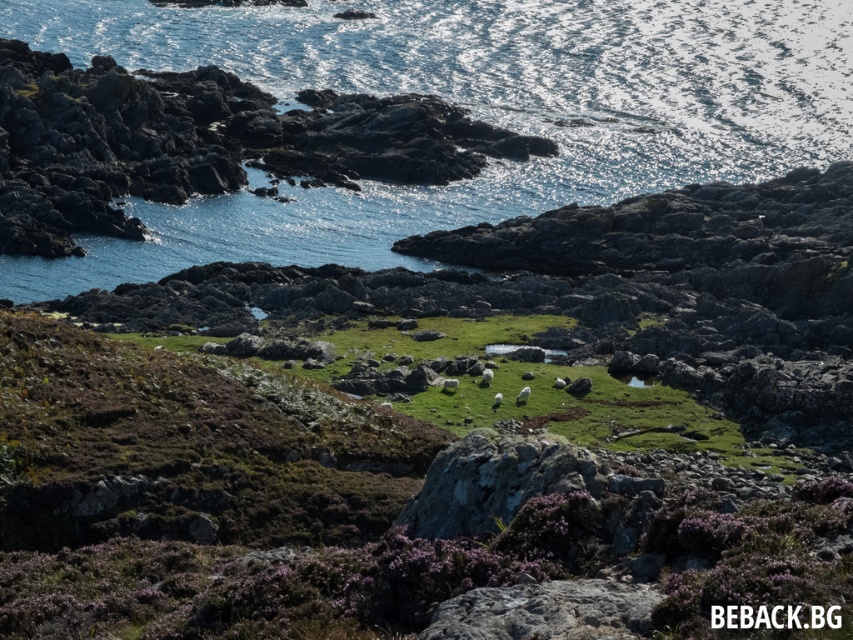
Question: Which point appears farthest from the camera in this image?

Choices:
 (A) 793,388
 (B) 140,241

Answer: (B)

Question: Estimate the real-world distances between objects in this image. Which object is farther from the gray rough rock at lower center?

Choices:
 (A) green grass at center
 (B) clear water at upper center

Answer: (B)

Question: Which point appears farthest from the camera in this image?

Choices:
 (A) (706, 12)
 (B) (503, 605)
 (C) (766, 464)

Answer: (A)

Question: Does clear water at upper center appear on the left side of gray rough rock at lower center?

Choices:
 (A) no
 (B) yes

Answer: (B)

Question: Is green grass at center smaller than gray rough rock at lower center?

Choices:
 (A) no
 (B) yes

Answer: (A)

Question: Is green grass at center thinner than gray rough rock at lower center?

Choices:
 (A) yes
 (B) no

Answer: (B)